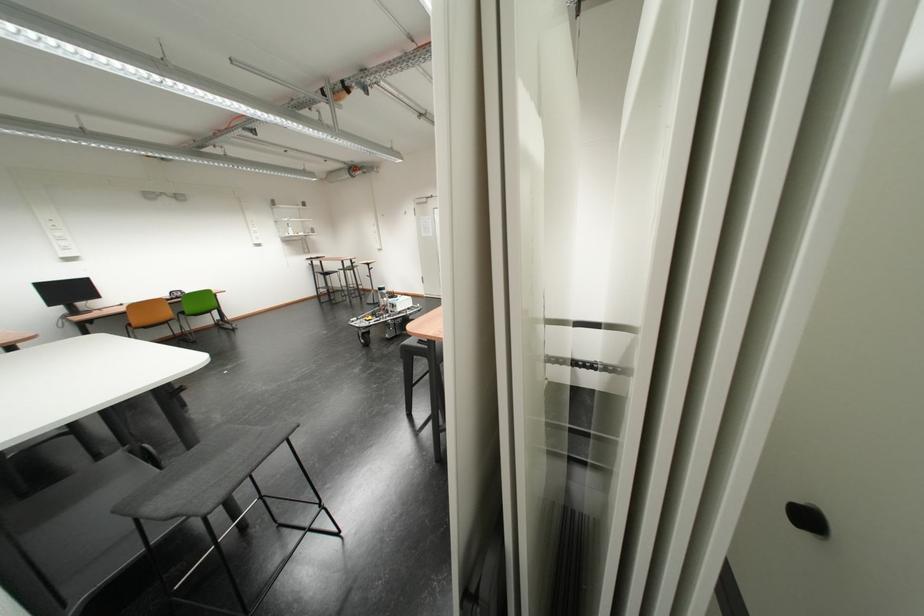
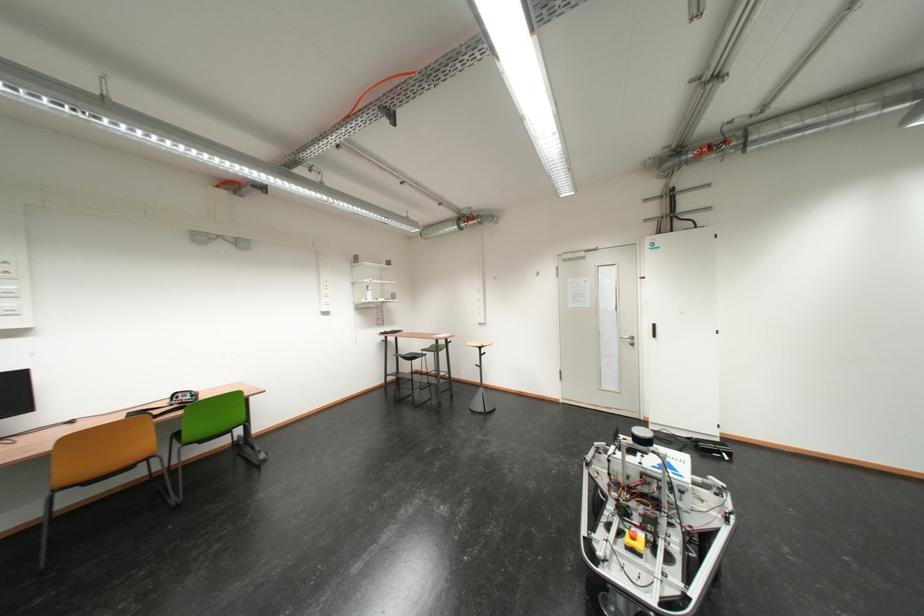
What movement of the cameraman would produce the second image?

The cameraman walked toward left, forward.